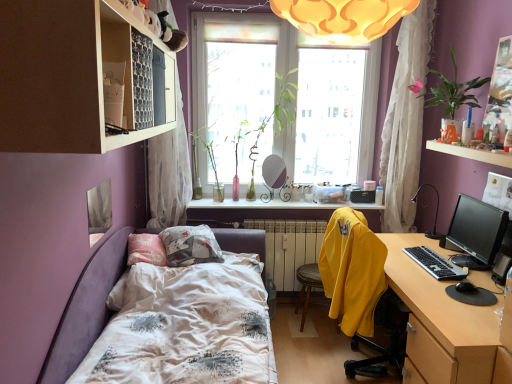
Question: From the image's perspective, would you say pink glass vase at window, which is the 2th plant in left-to-right order, is shown under black plastic keyboard at right?

Choices:
 (A) no
 (B) yes

Answer: (A)

Question: From a real-world perspective, is pink glass vase at window, which is the 2th plant in left-to-right order, on top of black plastic keyboard at right?

Choices:
 (A) yes
 (B) no

Answer: (A)

Question: Does pink glass vase at window, which is the 2th plant in left-to-right order, have a lesser width compared to black plastic keyboard at right?

Choices:
 (A) yes
 (B) no

Answer: (B)

Question: Is black plastic keyboard at right at the back of pink glass vase at window, arranged as the third plant when viewed from the right?

Choices:
 (A) no
 (B) yes

Answer: (A)

Question: Is pink glass vase at window, arranged as the third plant when viewed from the right, far away from black plastic keyboard at right?

Choices:
 (A) no
 (B) yes

Answer: (B)

Question: From a real-world perspective, relative to translucent glass vase at upper center, the first window sill from the top, is white cotton bed at center vertically above or below?

Choices:
 (A) below
 (B) above

Answer: (A)

Question: In the image, is white cotton bed at center positioned in front of or behind translucent glass vase at upper center, positioned as the first window sill in front-to-back order?

Choices:
 (A) front
 (B) behind

Answer: (A)

Question: From the image's perspective, is white cotton bed at center located above or below translucent glass vase at upper center, which is the first window sill in right-to-left order?

Choices:
 (A) above
 (B) below

Answer: (B)

Question: In terms of height, does white cotton bed at center look taller or shorter compared to translucent glass vase at upper center, the first window sill from the top?

Choices:
 (A) tall
 (B) short

Answer: (A)

Question: Is point click(432, 294) positioned closer to the camera than point click(463, 271)?

Choices:
 (A) closer
 (B) farther

Answer: (A)

Question: In terms of width, does wooden desk at right look wider or thinner when compared to black plastic keyboard at right?

Choices:
 (A) wide
 (B) thin

Answer: (A)

Question: Which is correct: wooden desk at right is inside black plastic keyboard at right, or outside of it?

Choices:
 (A) outside
 (B) inside

Answer: (A)

Question: From a real-world perspective, is wooden desk at right above or below black plastic keyboard at right?

Choices:
 (A) above
 (B) below

Answer: (B)

Question: From a real-world perspective, relative to black plastic keyboard at right, is white sheer curtain at left, placed as the 2th curtain when sorted from right to left, vertically above or below?

Choices:
 (A) above
 (B) below

Answer: (A)

Question: In the image, is white sheer curtain at left, placed as the 1th curtain when sorted from left to right, on the left side or the right side of black plastic keyboard at right?

Choices:
 (A) left
 (B) right

Answer: (A)